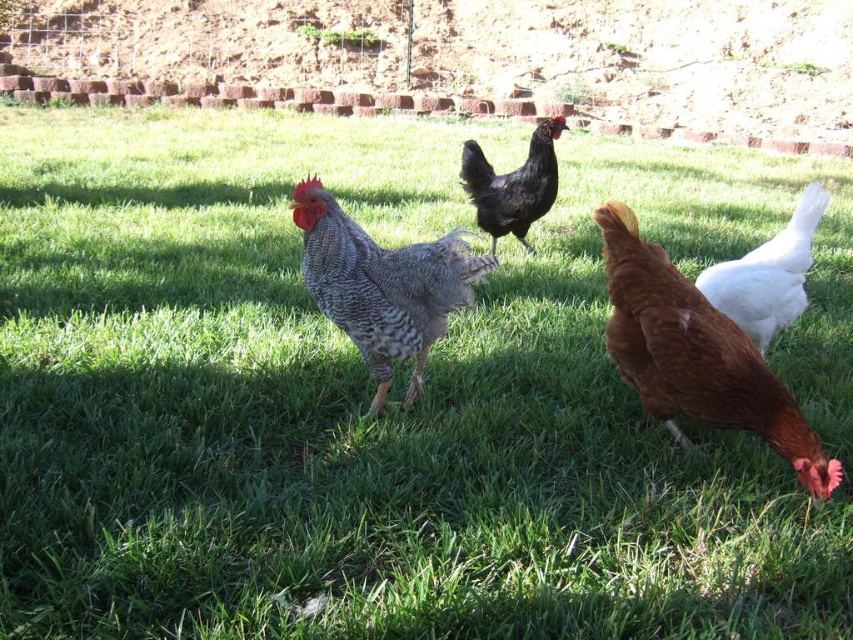
Is speckled feathered rooster at center to the right of white glossy chicken at center from the viewer's perspective?

In fact, speckled feathered rooster at center is to the left of white glossy chicken at center.

Describe the element at coordinates (381, 285) in the screenshot. The image size is (853, 640). I see `speckled feathered rooster at center` at that location.

Between point (338, 323) and point (775, 262), which one is positioned in front?

Point (338, 323) is in front.

Where is `speckled feathered rooster at center`? speckled feathered rooster at center is located at coordinates (381, 285).

Is point (790, 230) less distant than point (477, 220)?

Yes.

Locate an element on the screen. white glossy chicken at center is located at coordinates (769, 275).

The height and width of the screenshot is (640, 853). What are the coordinates of `white glossy chicken at center` in the screenshot? It's located at (769, 275).

Between brown matte chicken at lower right and speckled feathered rooster at center, which one has more height?

brown matte chicken at lower right is taller.

Between brown matte chicken at lower right and speckled feathered rooster at center, which one is positioned higher?

speckled feathered rooster at center is above.

Between point (677, 426) and point (374, 316), which one is positioned in front?

Point (374, 316) is in front.

In order to click on brown matte chicken at lower right in this screenshot , I will do `click(695, 355)`.